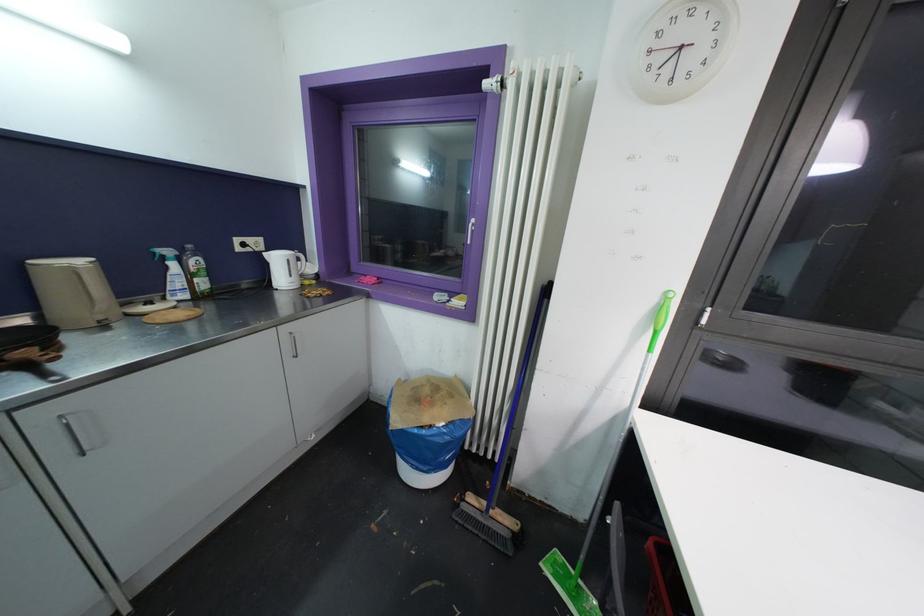
Locate an element on the screen. This screenshot has width=924, height=616. spray bottle trigger is located at coordinates 159,254.